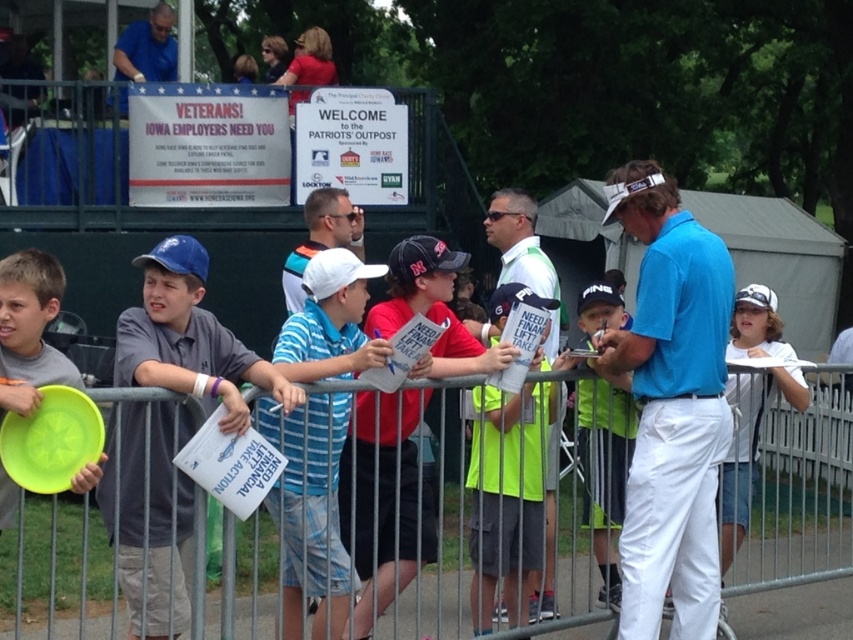
Question: Among these objects, which one is farthest from the camera?

Choices:
 (A) blue striped shirt at center
 (B) neon green jersey at center
 (C) neon yellow shirt at center
 (D) green matte frisbee at left

Answer: (B)

Question: Can you confirm if gray matte shirt at left is thinner than blue striped shirt at center?

Choices:
 (A) yes
 (B) no

Answer: (B)

Question: Does neon yellow shirt at center appear on the left side of matte green frisbee at left?

Choices:
 (A) yes
 (B) no

Answer: (B)

Question: Which of these objects is positioned closest to the neon green jersey at center?

Choices:
 (A) green matte frisbee at left
 (B) gray matte shirt at left
 (C) metallic silver fence at center
 (D) matte green frisbee at left

Answer: (C)

Question: Which is nearer to the matte green frisbee at left?

Choices:
 (A) metallic silver fence at center
 (B) gray matte shirt at left
 (C) neon green jersey at center
 (D) neon yellow shirt at center

Answer: (B)

Question: Can you confirm if gray matte shirt at left is positioned to the left of green matte frisbee at left?

Choices:
 (A) yes
 (B) no

Answer: (B)